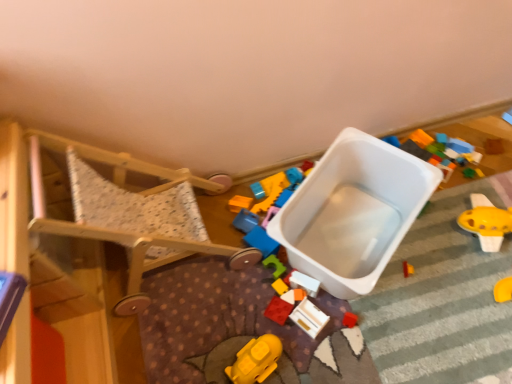
Find the location of `vacant area that lies between yellow matte toy at lower center, which is counted as the first toy, starting from the left, and yellow plastic toy at right, which is counted as the first toy, starting from the right`. vacant area that lies between yellow matte toy at lower center, which is counted as the first toy, starting from the left, and yellow plastic toy at right, which is counted as the first toy, starting from the right is located at coordinates (387, 295).